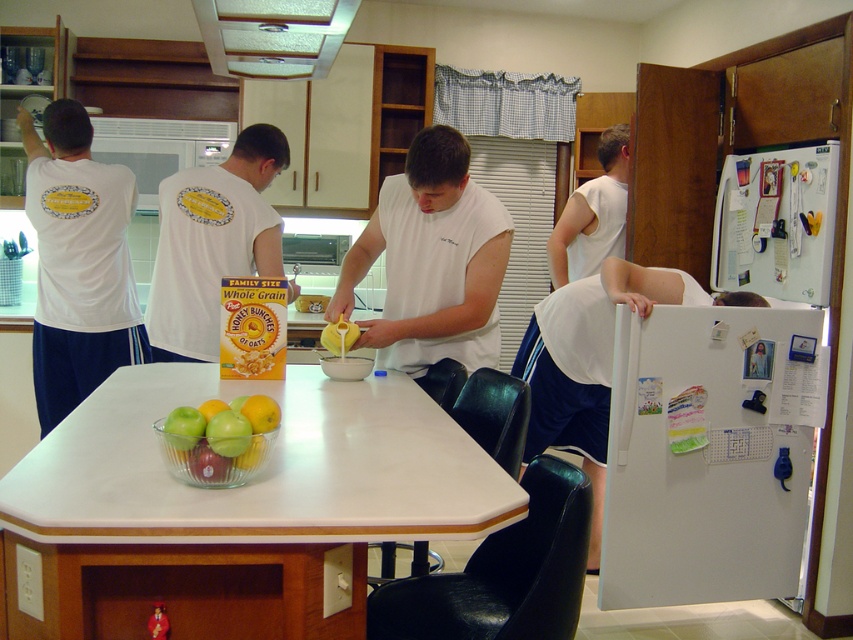
Can you confirm if white matte shirt at center is positioned below white matte refrigerator at upper right?

Correct, white matte shirt at center is located below white matte refrigerator at upper right.

Between white matte shirt at center and white matte refrigerator at upper right, which one is positioned higher?

white matte refrigerator at upper right

This screenshot has height=640, width=853. Describe the element at coordinates (432, 260) in the screenshot. I see `white matte shirt at center` at that location.

At what (x,y) coordinates should I click in order to perform the action: click on white matte shirt at center. Please return your answer as a coordinate pair (x, y). This screenshot has width=853, height=640. Looking at the image, I should click on (432, 260).

Who is higher up, white laminate table at center or white matte shirt at center?

white matte shirt at center is above.

Where is `white laminate table at center`? white laminate table at center is located at coordinates (236, 508).

Between white laminate table at center and white sleeveless shirt at right, which one appears on the right side from the viewer's perspective?

Positioned to the right is white sleeveless shirt at right.

Identify the location of white laminate table at center. (236, 508).